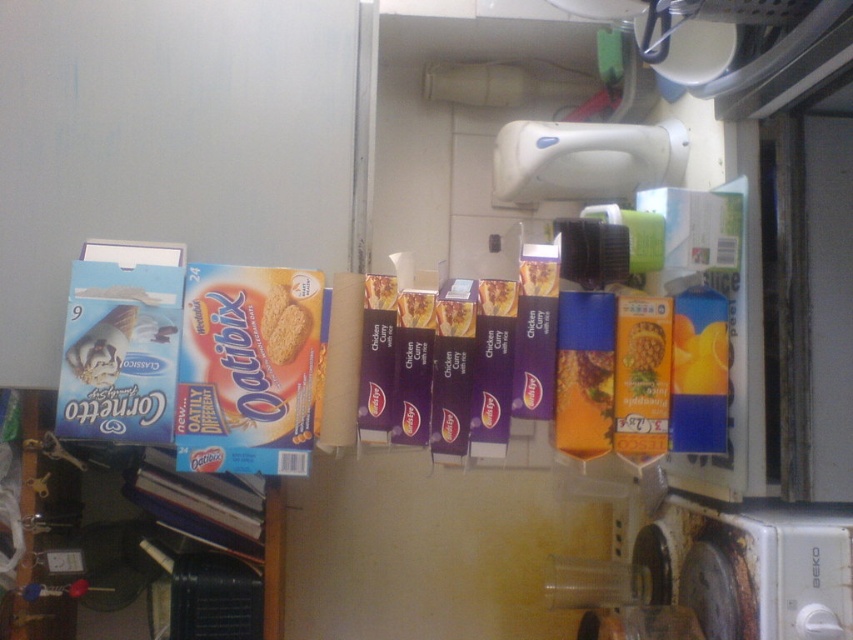
Question: Which of the following is the farthest from the observer?

Choices:
 (A) matte cardboard oatibix at center
 (B) blue cardboard box at left

Answer: (B)

Question: Among these objects, which one is nearest to the camera?

Choices:
 (A) blue cardboard box at left
 (B) matte cardboard box at center

Answer: (B)

Question: Can you confirm if rusty metal stove at lower right is thinner than purple matte chicken curry sauce at center?

Choices:
 (A) yes
 (B) no

Answer: (B)

Question: Does blue cardboard box at left appear over purple matte chicken curry sauce at center?

Choices:
 (A) yes
 (B) no

Answer: (B)

Question: Can you confirm if rusty metal stove at lower right is thinner than blue cardboard box at left?

Choices:
 (A) yes
 (B) no

Answer: (B)

Question: Considering the real-world distances, which object is closest to the rusty metal stove at lower right?

Choices:
 (A) matte cardboard box at center
 (B) matte cardboard oatibix at center
 (C) blue cardboard box at left

Answer: (A)